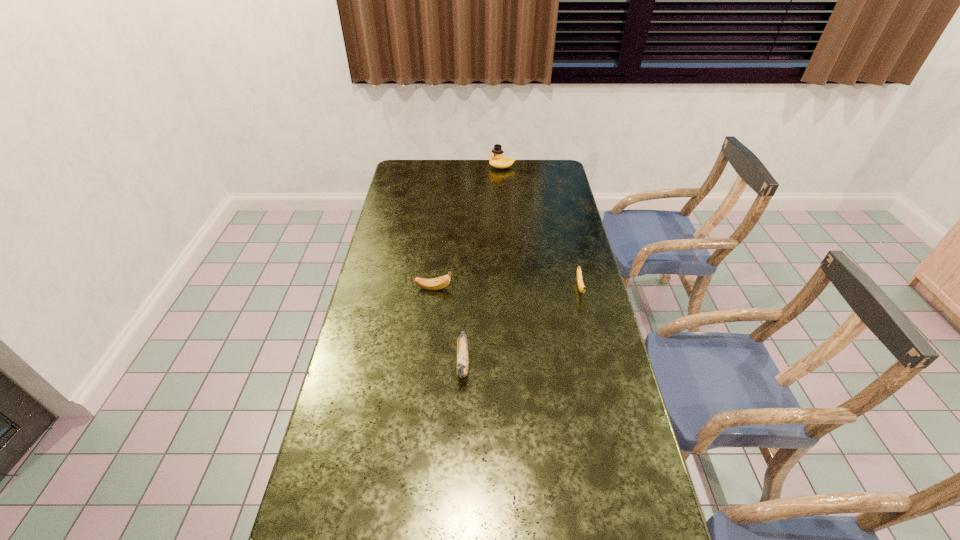
Choose which object is the nearest neighbor to the shortest banana. Please provide its 2D coordinates. Your answer should be formatted as a tuple, i.e. [(x, y)], where the tuple contains the x and y coordinates of a point satisfying the conditions above.

[(462, 347)]

Point out which banana is positioned as the second nearest to the nearest object. Please provide its 2D coordinates. Your answer should be formatted as a tuple, i.e. [(x, y)], where the tuple contains the x and y coordinates of a point satisfying the conditions above.

[(581, 287)]

I want to click on banana that stands as the closest to the rightmost banana, so click(x=462, y=347).

Locate an element on the screen. The height and width of the screenshot is (540, 960). blank area in the image that satisfies the following two spatial constraints: 1. on the front-facing side of the farthest object; 2. on the peel of the nearest object is located at coordinates tap(516, 363).

Where is `free space that satisfies the following two spatial constraints: 1. on the front-facing side of the third object from left to right; 2. on the peel of the nearest banana`? This screenshot has height=540, width=960. free space that satisfies the following two spatial constraints: 1. on the front-facing side of the third object from left to right; 2. on the peel of the nearest banana is located at coordinates (516, 363).